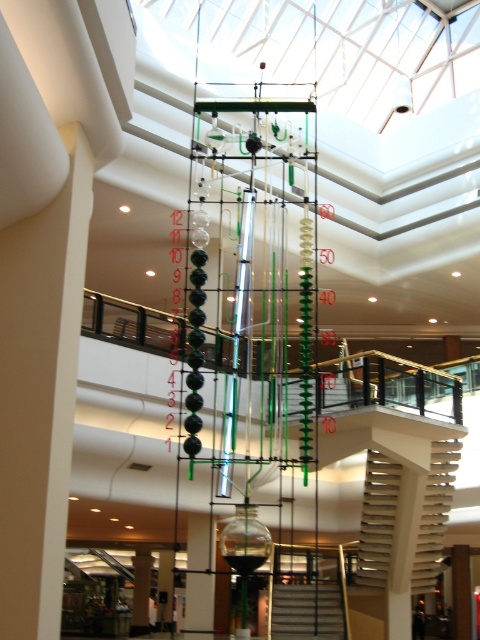
Between point (373, 458) and point (311, 634), which one is positioned behind?

Positioned behind is point (373, 458).

Locate an element on the screen. Image resolution: width=480 pixels, height=640 pixels. white textured stairs at center is located at coordinates (375, 522).